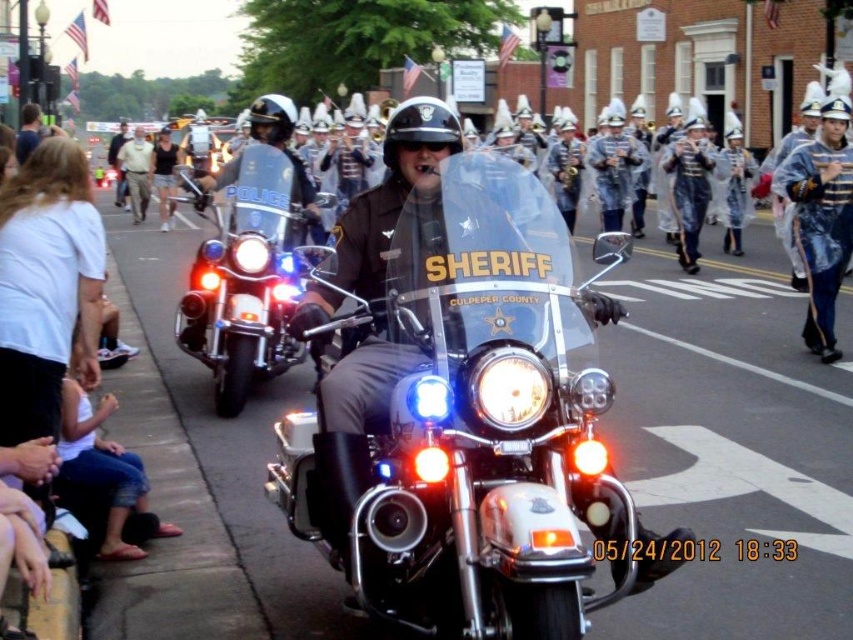
Question: Does polished chrome motorcycle at center appear under shiny chrome police motorcycle at center?

Choices:
 (A) yes
 (B) no

Answer: (A)

Question: Does polished chrome motorcycle at center appear on the left side of shiny chrome police motorcycle at center?

Choices:
 (A) yes
 (B) no

Answer: (B)

Question: Can you confirm if polished chrome motorcycle at center is positioned to the right of shiny chrome police motorcycle at center?

Choices:
 (A) no
 (B) yes

Answer: (B)

Question: Which point is closer to the camera taking this photo?

Choices:
 (A) (202, 321)
 (B) (444, 508)

Answer: (B)

Question: Which point is closer to the camera?

Choices:
 (A) (270, 305)
 (B) (608, 465)

Answer: (B)